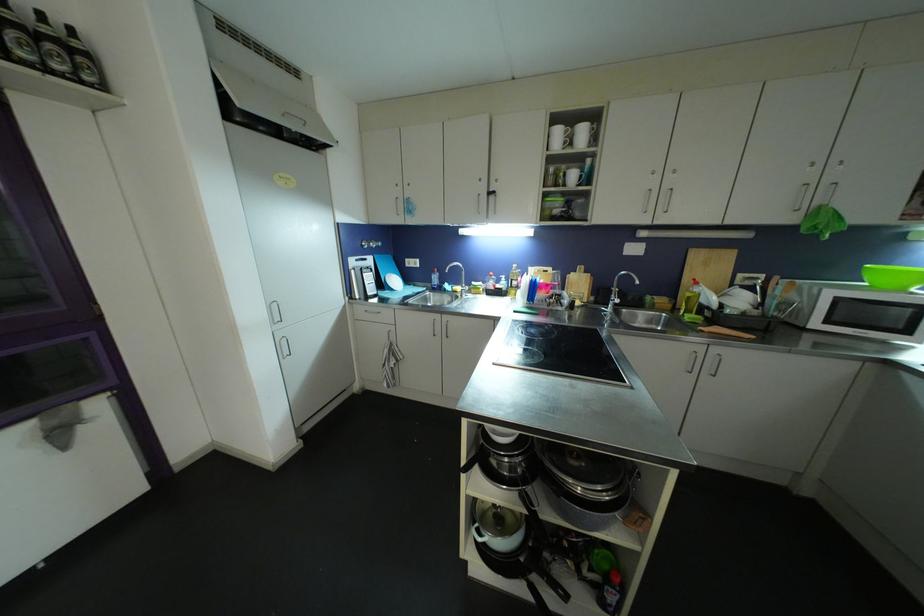
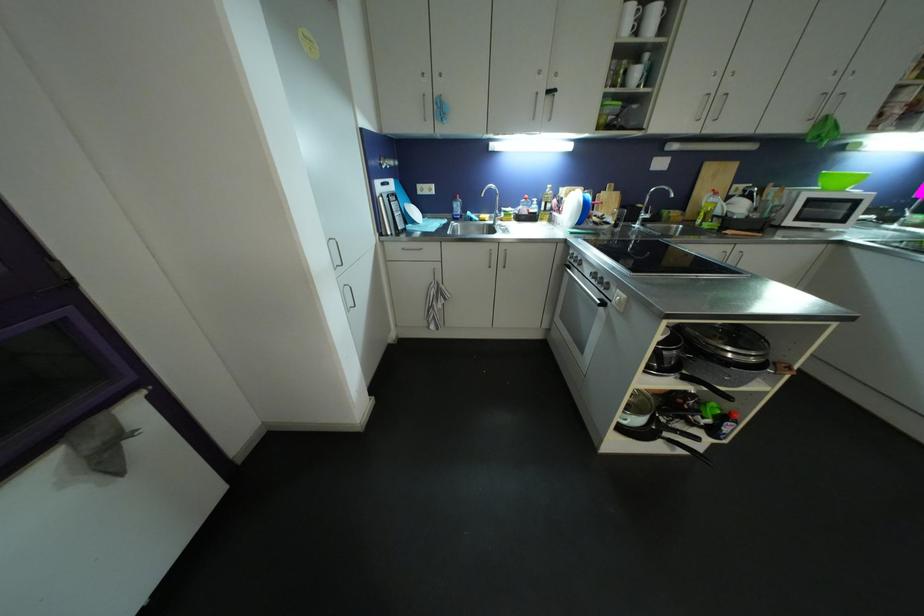
Where in the second image is the point corresponding to point 505,289 from the first image?

(539, 214)